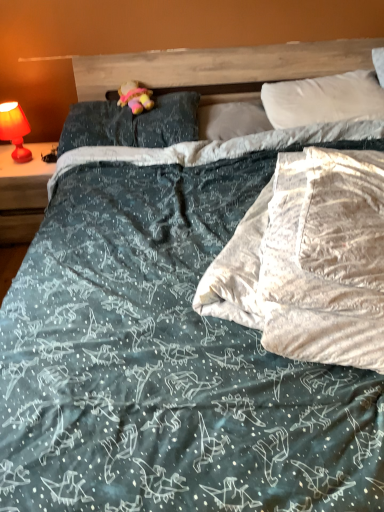
Question: Is pastel plush toy at center to the left or to the right of white soft pillow at center, marked as the second pillow in a left-to-right arrangement, in the image?

Choices:
 (A) right
 (B) left

Answer: (B)

Question: From the image's perspective, is pastel plush toy at center positioned above or below white soft pillow at center, which is the 2th pillow from right to left?

Choices:
 (A) above
 (B) below

Answer: (A)

Question: Estimate the real-world distances between objects in this image. Which object is closer to the white soft pillow at center, marked as the second pillow in a left-to-right arrangement?

Choices:
 (A) matte red lamp at left
 (B) pastel plush toy at center
 (C) white soft pillow at upper right, marked as the 3th pillow in a left-to-right arrangement
 (D) dark blue fabric pillow at upper center, which ranks as the third pillow in right-to-left order
 (E) matte red lamp at left

Answer: (C)

Question: Estimate the real-world distances between objects in this image. Which object is farther from the pastel plush toy at center?

Choices:
 (A) matte red lamp at left
 (B) matte red lamp at left
 (C) dark blue fabric pillow at upper center, which ranks as the third pillow in right-to-left order
 (D) white soft pillow at upper right, marked as the 3th pillow in a left-to-right arrangement
 (E) white soft pillow at center, which is the 2th pillow from right to left

Answer: (D)